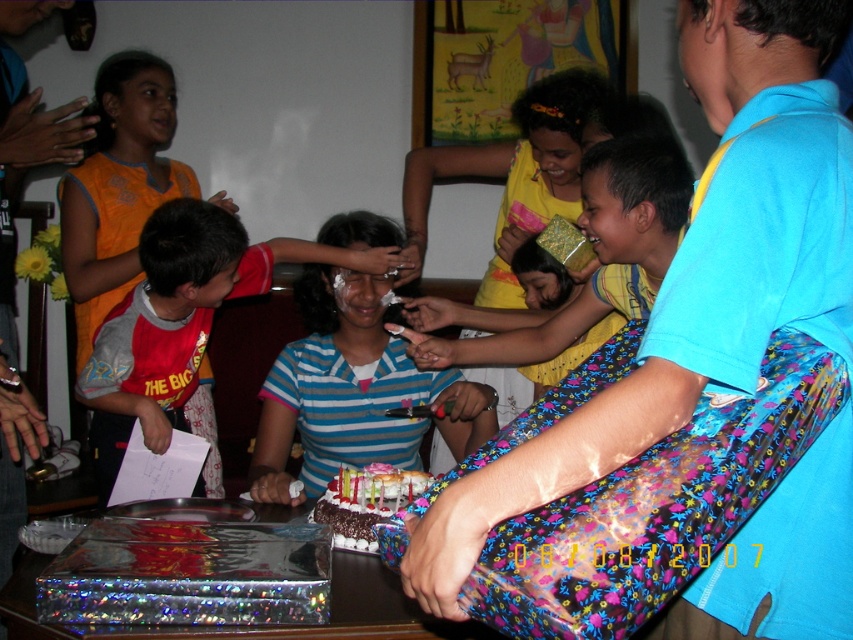
Is point (111, 344) positioned after point (358, 516)?

Yes, it is.

Which is in front, point (187, 257) or point (334, 484)?

Point (334, 484) is in front.

At what (x,y) coordinates should I click in order to perform the action: click on striped cotton shirt at center. Please return your answer as a coordinate pair (x, y). The width and height of the screenshot is (853, 640). Looking at the image, I should click on (178, 321).

You are a GUI agent. You are given a task and a screenshot of the screen. Output one action in this format:
    pyautogui.click(x=<x>, y=<y>)
    Task: Click on the striped cotton shirt at center
    Image resolution: width=853 pixels, height=640 pixels.
    Given the screenshot: What is the action you would take?
    pyautogui.click(x=178, y=321)

Is point (456, 440) positioned behind point (196, 330)?

No, it is in front of (196, 330).

Image resolution: width=853 pixels, height=640 pixels. What do you see at coordinates (352, 392) in the screenshot? I see `blue striped shirt at center` at bounding box center [352, 392].

The height and width of the screenshot is (640, 853). In order to click on blue striped shirt at center in this screenshot , I will do `click(352, 392)`.

Where is `blue striped shirt at center`? blue striped shirt at center is located at coordinates (352, 392).

Does blue striped shirt at center lie behind chocolate frosted cake at center?

That is True.

Between point (287, 380) and point (349, 540), which one is positioned behind?

Point (287, 380)

I want to click on blue striped shirt at center, so click(352, 392).